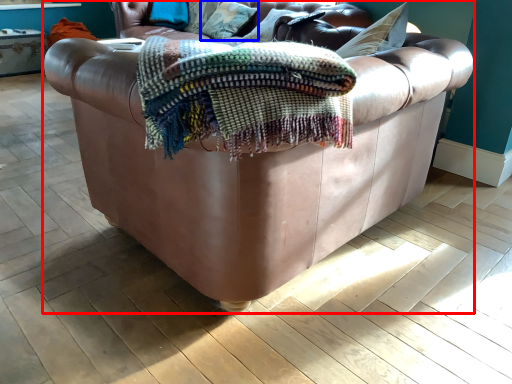
Question: Among these objects, which one is nearest to the camera, studio couch (highlighted by a red box) or pillow (highlighted by a blue box)?

Choices:
 (A) studio couch
 (B) pillow

Answer: (A)